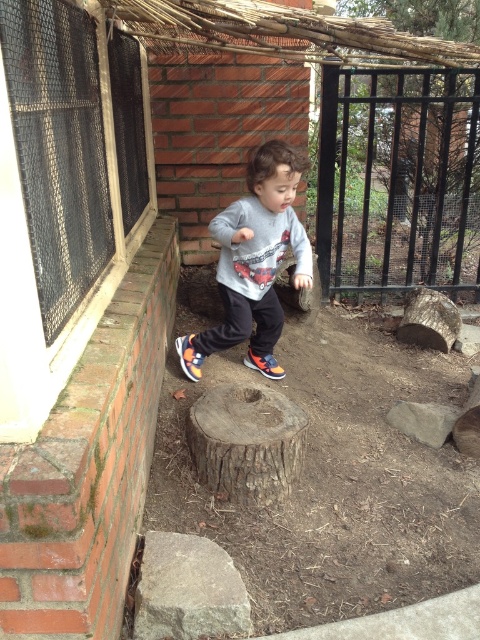
The child is wearing two shoes. The multicolored fabric shoe at center and the orange suede shoe at center. Which shoe is narrower?

The multicolored fabric shoe at center is narrower than the orange suede shoe at center.

You are a photographer standing in the backyard and want to take a closeup photo of the multicolored fabric shoe at center. If your camera has a maximum focus range of 8 feet, will you be able to capture the shoe clearly without moving closer?

The multicolored fabric shoe at center is 8.86 feet from the camera. Since the camera can only focus up to 8 feet, it won measurements and cannot focus clearly at that distance. Move closer to ensure the shoe is within the 8 feet range for a clear photo.

You are a drone operator trying to capture a photo of the brown rough wood stump at center. The drone is currently hovering at point A, which is at coordinates 0.5, 0.5. To get a clear shot of the stump, should you move the drone north or south?

The brown rough wood stump at center is located at point (247, 442). Since the drone is at (240, 320), moving north would increase the y coordinate. The stump is slightly north of the drone, so moving north would bring the drone closer to the stump for a clear shot.